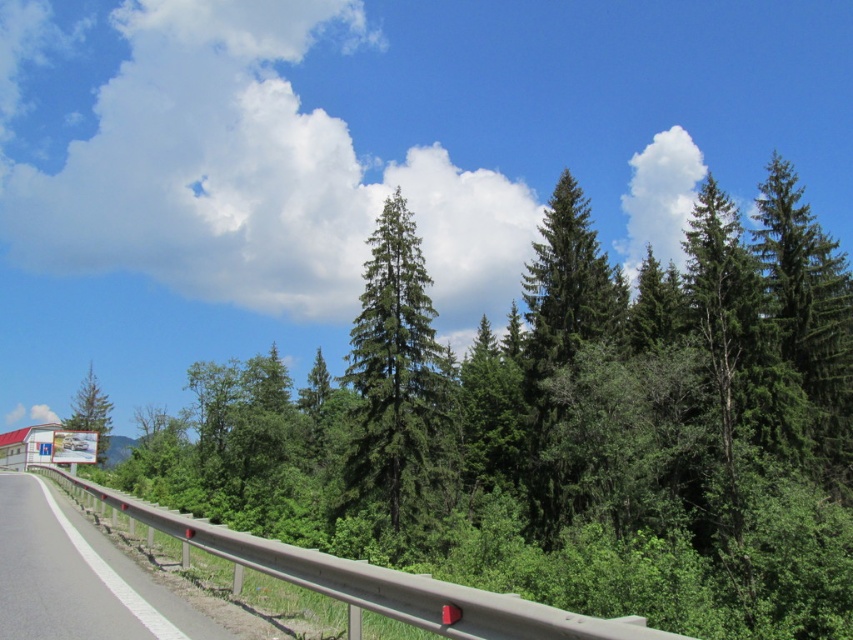
You are driving along the road and notice two green matte trees ahead. Which one is taller, the green matte tree at center or the green matte tree at upper center?

The green matte tree at upper center is taller than the green matte tree at center.

You are standing at the starting point of the road and want to reach the green matte tree at center. Which direction should you walk to get there?

The green matte tree at center is located at point (399, 385), so you should walk forward along the road since it is in front of you.

You are driving along the road and need to know the exact position of the metallic gray guardrail at lower left for navigation. What are its coordinates?

The metallic gray guardrail at lower left is located at point (x=76, y=577).